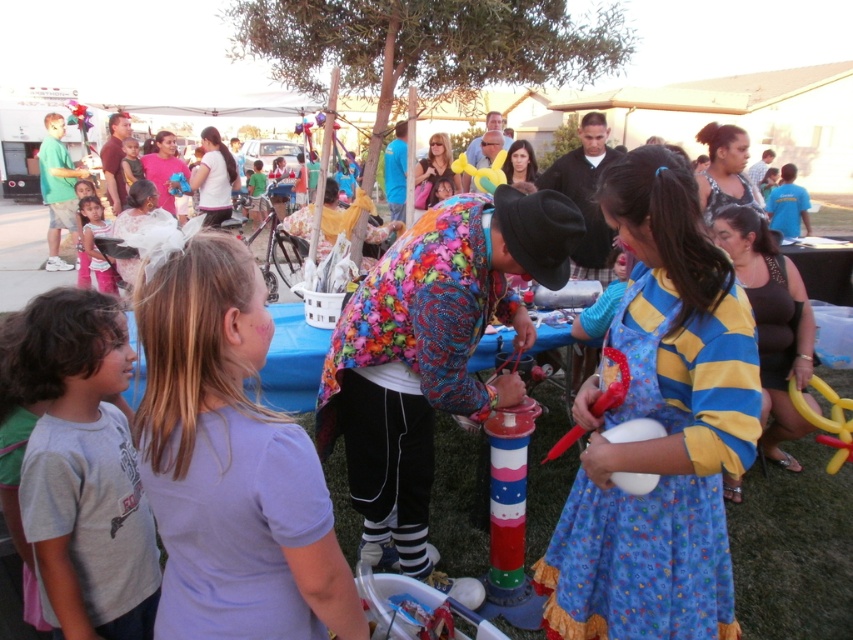
You are an artist creating a painting of this scene. You need to decide which clothing item to emphasize in terms of texture detail. Since the purple cotton shirt at center is thinner than the blue cotton dress at center, which one should you focus on to highlight the texture of the fabric?

The blue cotton dress at center has a thicker fabric, so you should focus on emphasizing its texture in the painting.